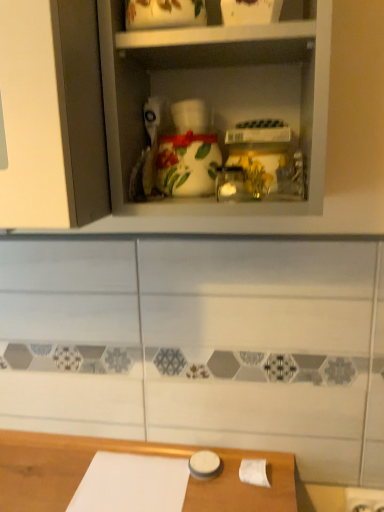
The height and width of the screenshot is (512, 384). What do you see at coordinates (220, 98) in the screenshot?
I see `white glossy vase at center` at bounding box center [220, 98].

I want to click on white glossy vase at center, so click(220, 98).

Measure the distance between white paper at lower right and camera.

white paper at lower right is 32.76 inches away from camera.

I want to click on white paper at lower right, so click(x=254, y=472).

The height and width of the screenshot is (512, 384). What do you see at coordinates (254, 472) in the screenshot? I see `white paper at lower right` at bounding box center [254, 472].

Locate an element on the screen. The width and height of the screenshot is (384, 512). white glossy vase at center is located at coordinates (220, 98).

Between white glossy vase at center and white paper at lower right, which one appears on the left side from the viewer's perspective?

white glossy vase at center.

Is white glossy vase at center positioned behind white paper at lower right?

That is False.

Does point (235, 106) lie in front of point (250, 476)?

Yes, point (235, 106) is closer to viewer.

From the image's perspective, which one is positioned higher, white glossy vase at center or white paper at lower right?

white glossy vase at center, from the image's perspective.

From a real-world perspective, which is physically below, white glossy vase at center or white paper at lower right?

In real-world perspective, white paper at lower right is lower.

From the picture: In terms of width, does white glossy vase at center look wider or thinner when compared to white paper at lower right?

In the image, white glossy vase at center appears to be wider than white paper at lower right.

Who is shorter, white glossy vase at center or white paper at lower right?

Standing shorter between the two is white paper at lower right.

Can you confirm if white glossy vase at center is smaller than white paper at lower right?

Actually, white glossy vase at center might be larger than white paper at lower right.

Is white paper at lower right surrounded by white glossy vase at center?

Actually, white paper at lower right is outside white glossy vase at center.

Would you consider white glossy vase at center to be distant from white paper at lower right?

white glossy vase at center is near white paper at lower right, not far away.

Is white glossy vase at center looking in the opposite direction of white paper at lower right?

No, white glossy vase at center is not facing the opposite direction of white paper at lower right.

Can you tell me how much white glossy vase at center and white paper at lower right differ in facing direction?

The angular difference between white glossy vase at center and white paper at lower right is 2.09 degrees.

I want to click on toilet paper directly beneath the white glossy vase at center (from a real-world perspective), so click(254, 472).

Considering the relative positions of white paper at lower right and white glossy vase at center in the image provided, is white paper at lower right to the left of white glossy vase at center from the viewer's perspective?

No.

Does white paper at lower right lie behind white glossy vase at center?

Yes, white paper at lower right is further from the camera.

Considering the positions of points (258, 475) and (280, 211), is point (258, 475) closer to camera compared to point (280, 211)?

No, it is not.

From the image's perspective, which is above, white paper at lower right or white glossy vase at center?

white glossy vase at center.

From a real-world perspective, does white paper at lower right stand above white glossy vase at center?

No, from a real-world perspective, white paper at lower right is not over white glossy vase at center

Looking at this image, does white paper at lower right have a greater width compared to white glossy vase at center?

No, white paper at lower right is not wider than white glossy vase at center.

Between white paper at lower right and white glossy vase at center, which one has more height?

With more height is white glossy vase at center.

Is white paper at lower right bigger or smaller than white glossy vase at center?

In the image, white paper at lower right appears to be smaller than white glossy vase at center.

Is white glossy vase at center inside white paper at lower right?

That's incorrect, white glossy vase at center is not inside white paper at lower right.

In the scene shown: Is white paper at lower right with white glossy vase at center?

No, white paper at lower right is not with white glossy vase at center.

Is white paper at lower right facing away from white glossy vase at center?

No, white paper at lower right is not facing away from white glossy vase at center.

What's the angular difference between white paper at lower right and white glossy vase at center's facing directions?

There is a 2.09-degree angle between the facing directions of white paper at lower right and white glossy vase at center.

This screenshot has height=512, width=384. Identify the location of shelf located on the left of white paper at lower right. (220, 98).

Locate an element on the screen. The image size is (384, 512). toilet paper to the right of white glossy vase at center is located at coordinates tap(254, 472).

Identify the location of toilet paper behind the white glossy vase at center. The width and height of the screenshot is (384, 512). (254, 472).